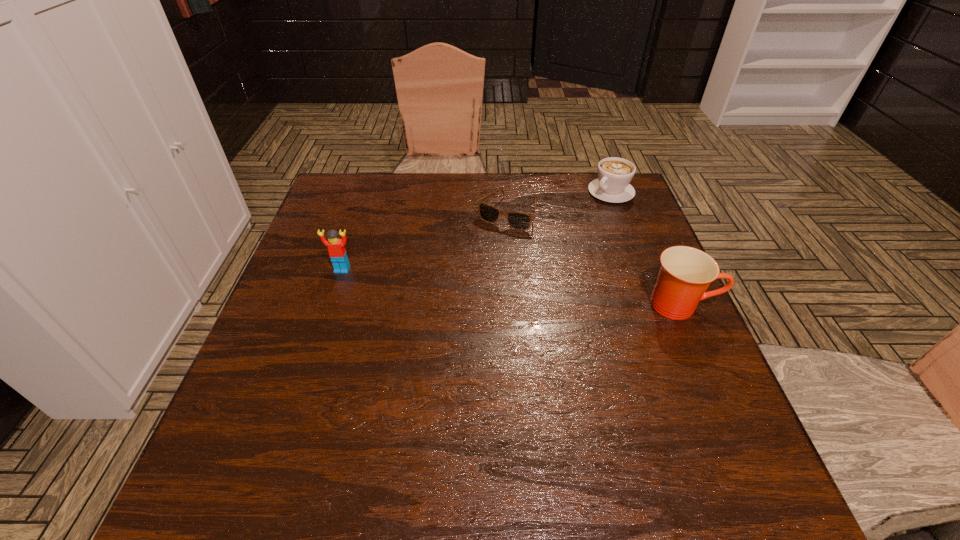
This screenshot has height=540, width=960. I want to click on unoccupied position between the nearest object and the third farthest object, so click(x=512, y=287).

I want to click on free space that is in between the nearest object and the cappuccino, so click(646, 248).

The width and height of the screenshot is (960, 540). I want to click on vacant area that lies between the third object from right to left and the cappuccino, so click(559, 202).

You are a GUI agent. You are given a task and a screenshot of the screen. Output one action in this format:
    pyautogui.click(x=<x>, y=<y>)
    Task: Click on the vacant area between the shortest object and the cup
    This screenshot has width=960, height=540.
    Given the screenshot: What is the action you would take?
    pyautogui.click(x=593, y=259)

What are the coordinates of `free space between the shortest object and the leftmost object` in the screenshot? It's located at (424, 241).

The width and height of the screenshot is (960, 540). In order to click on free area in between the second shortest object and the third object from right to left in this screenshot , I will do `click(559, 202)`.

Identify which object is located as the nearest to the cup. Please provide its 2D coordinates. Your answer should be formatted as a tuple, i.e. [(x, y)], where the tuple contains the x and y coordinates of a point satisfying the conditions above.

[(521, 221)]

Select which object appears as the third closest to the third tallest object. Please provide its 2D coordinates. Your answer should be formatted as a tuple, i.e. [(x, y)], where the tuple contains the x and y coordinates of a point satisfying the conditions above.

[(336, 247)]

Locate an element on the screen. The height and width of the screenshot is (540, 960). free spot that satisfies the following two spatial constraints: 1. on the face of the nearest object; 2. on the left side of the Lego is located at coordinates (330, 305).

The height and width of the screenshot is (540, 960). What are the coordinates of `free location that satisfies the following two spatial constraints: 1. on the face of the cup; 2. on the right side of the second nearest object` in the screenshot? It's located at (330, 305).